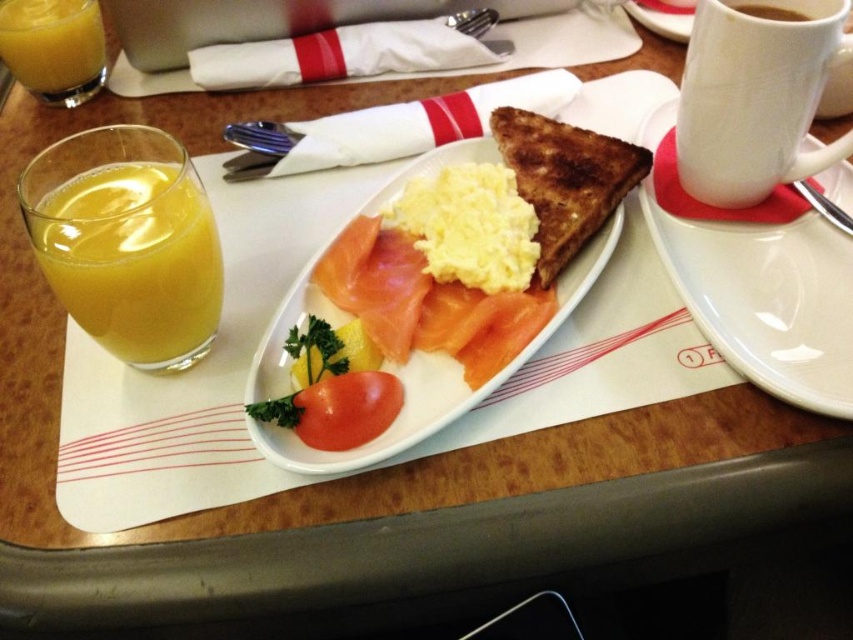
Between white ceramic mug at upper right and translucent glass of orange juice at left, which one appears on the right side from the viewer's perspective?

white ceramic mug at upper right is more to the right.

Is white ceramic mug at upper right positioned before translucent glass of orange juice at left?

Yes, it is in front of translucent glass of orange juice at left.

Who is more distant from viewer, (758, 179) or (74, 56)?

Positioned behind is point (74, 56).

Where is `white ceramic mug at upper right`? white ceramic mug at upper right is located at coordinates (755, 99).

Who is more forward, (692, 284) or (306, 403)?

Point (306, 403) is more forward.

Between white ceramic plate at center and red matte tomato at center, which one appears on the right side from the viewer's perspective?

white ceramic plate at center is more to the right.

Does point (788, 300) come in front of point (341, 372)?

No, it is behind (341, 372).

The image size is (853, 640). What are the coordinates of `white ceramic plate at center` in the screenshot? It's located at (767, 300).

Who is higher up, white ceramic mug at upper right or red matte tomato at center?

white ceramic mug at upper right

Is white ceramic mug at upper right further to camera compared to red matte tomato at center?

Yes, it is behind red matte tomato at center.

Is point (784, 35) positioned before point (328, 387)?

No, it is behind (328, 387).

You are a GUI agent. You are given a task and a screenshot of the screen. Output one action in this format:
    pyautogui.click(x=<x>, y=<y>)
    Task: Click on the white ceramic mug at upper right
    The width and height of the screenshot is (853, 640).
    Given the screenshot: What is the action you would take?
    pos(755,99)